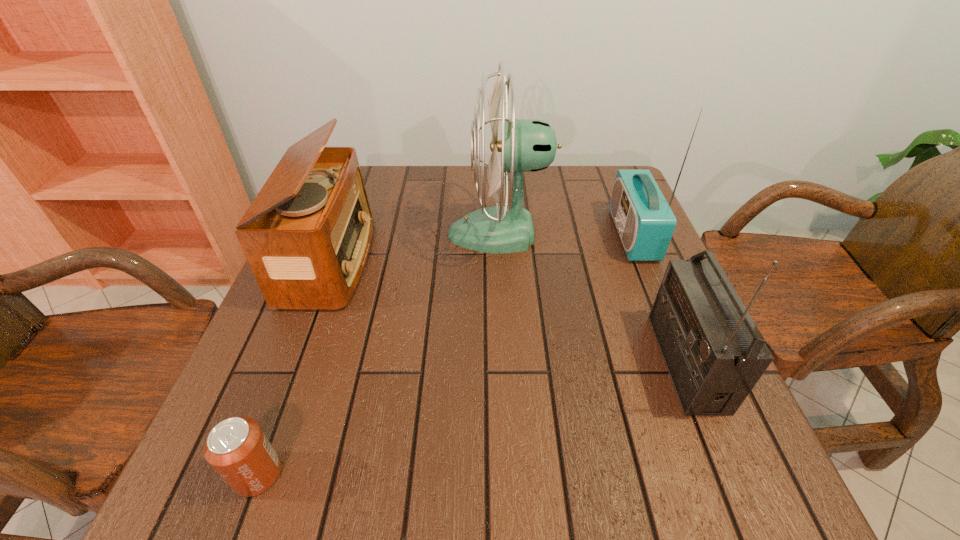
The image size is (960, 540). Identify the location of object present at the near left corner. (237, 448).

What are the coordinates of `object positioned at the far right corner` in the screenshot? It's located at (645, 222).

In the image, there is a desktop. Identify the location of free space at the far edge. This screenshot has height=540, width=960. point(391,207).

In the image, there is a desktop. Identify the location of vacant space at the near edge. (467, 495).

In the image, there is a desktop. Identify the location of vacant space at the left edge. (298, 426).

Identify the location of vacant space at the right edge of the desktop. (602, 250).

This screenshot has height=540, width=960. I want to click on blank space at the far left corner, so click(376, 172).

In the image, there is a desktop. In order to click on free space at the near left corner in this screenshot , I will do `click(227, 504)`.

The image size is (960, 540). In the image, there is a desktop. Identify the location of free space at the far right corner. (575, 171).

The width and height of the screenshot is (960, 540). Find the location of `empty space that is in between the shortest object and the second nearest object`. empty space that is in between the shortest object and the second nearest object is located at coordinates (471, 418).